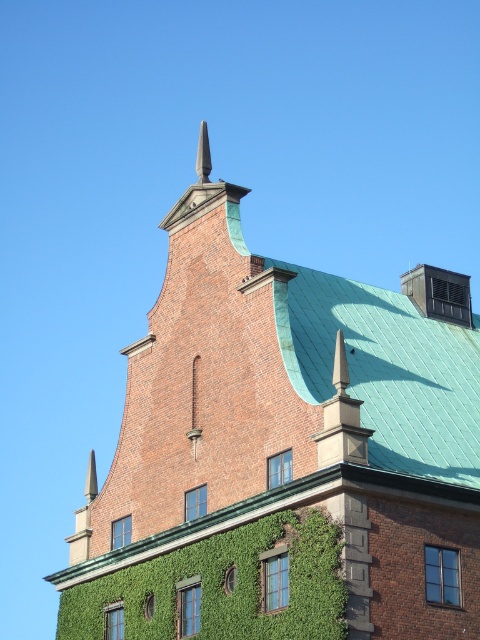
Consider the image. Who is more forward, (x=326, y=458) or (x=300, y=557)?

Point (x=300, y=557) is in front.

Image resolution: width=480 pixels, height=640 pixels. Describe the element at coordinates (284, 452) in the screenshot. I see `brick tower at center` at that location.

Identify the location of brick tower at center. (284, 452).